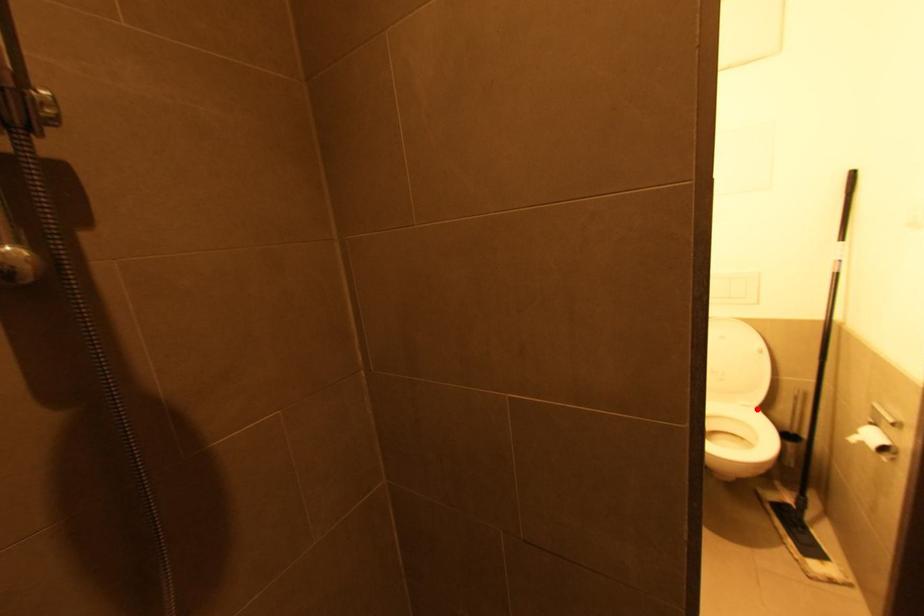
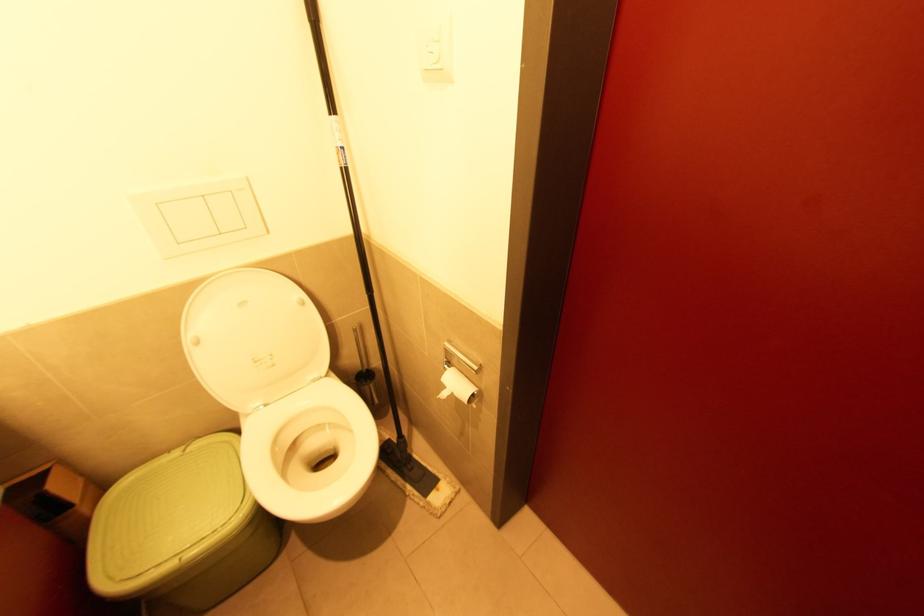
Question: A red point is marked in image1. In image2, is the corresponding 3D point closer to the camera or farther? Reply with the corresponding letter.

Choices:
 (A) The corresponding 3D point is closer.
 (B) The corresponding 3D point is farther.

Answer: (A)